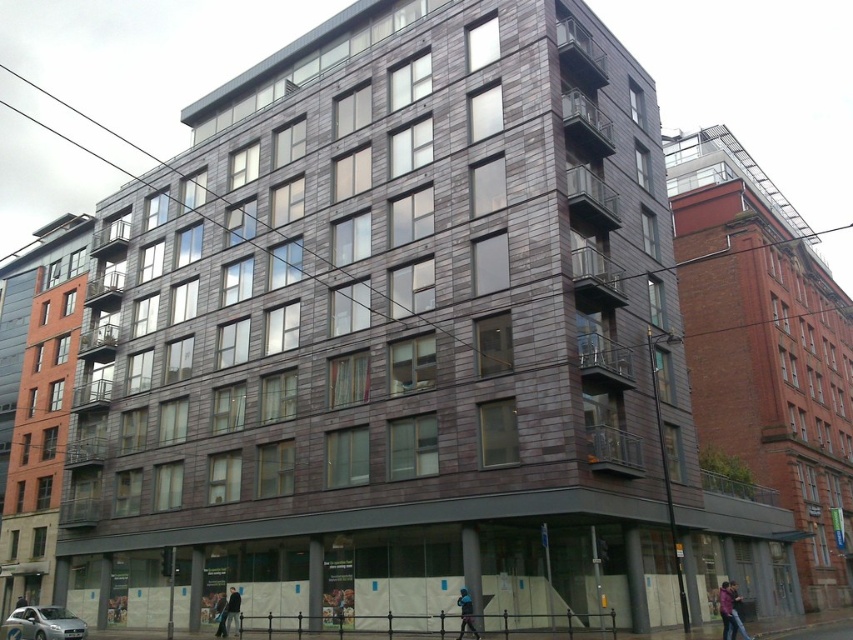
You are a delivery person trying to place a package between the blue fabric jacket at lower center and the dark blue jacket at lower center. Can the package fit between them if the package is 1.2 meters wide?

The blue fabric jacket at lower center is wider than the dark blue jacket at lower center, but the exact width difference isn